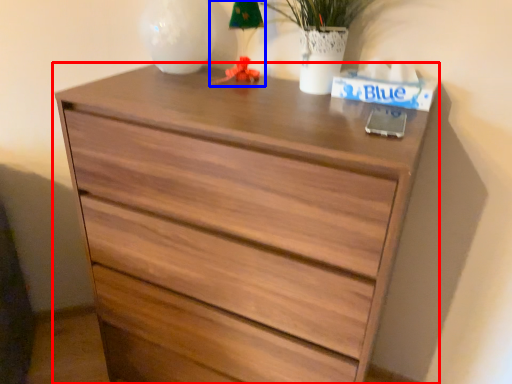
Question: Among these objects, which one is farthest to the camera, chest of drawers (highlighted by a red box) or table lamp (highlighted by a blue box)?

Choices:
 (A) chest of drawers
 (B) table lamp

Answer: (B)